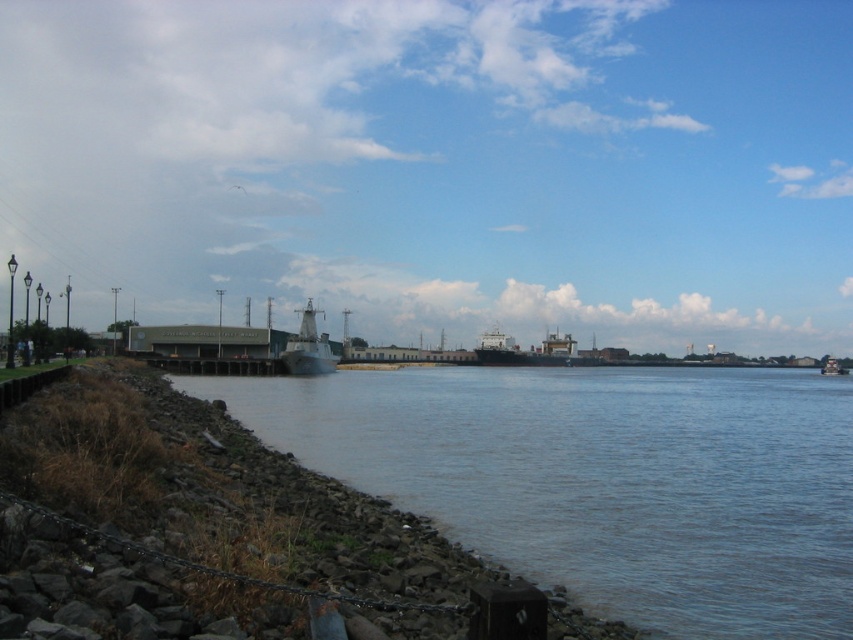
You are standing on the rocky shoreline and want to reach the metallic gray ship at center. According to the scene, which direction should you move relative to the gray stone river at lower left?

You should move to the left of the gray stone river at lower left to reach the metallic gray ship at center because the gray stone river at lower left is positioned to the right of the metallic gray ship at center.

You are a photographer trying to capture the entire view of the gray stone river at lower left and the metallic gray ship at center in one shot. Based on their widths, which object should you frame first to ensure both fit in the photo?

The gray stone river at lower left is wider than the metallic gray ship at center. To capture both in one shot, frame the gray stone river at lower left first since it occupies more space in the scene.

You are standing on the rocky shoreline and want to get to the metallic gray ship at center. Is the gray stone river at lower left between you and the ship?

Yes, the gray stone river at lower left is in front of the metallic gray ship at center, meaning it is between you and the ship.